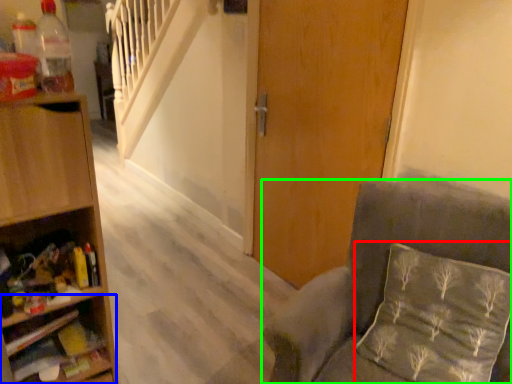
Question: Which is nearer to the pillow (highlighted by a red box)? shelf (highlighted by a blue box) or chair (highlighted by a green box).

Choices:
 (A) shelf
 (B) chair

Answer: (B)